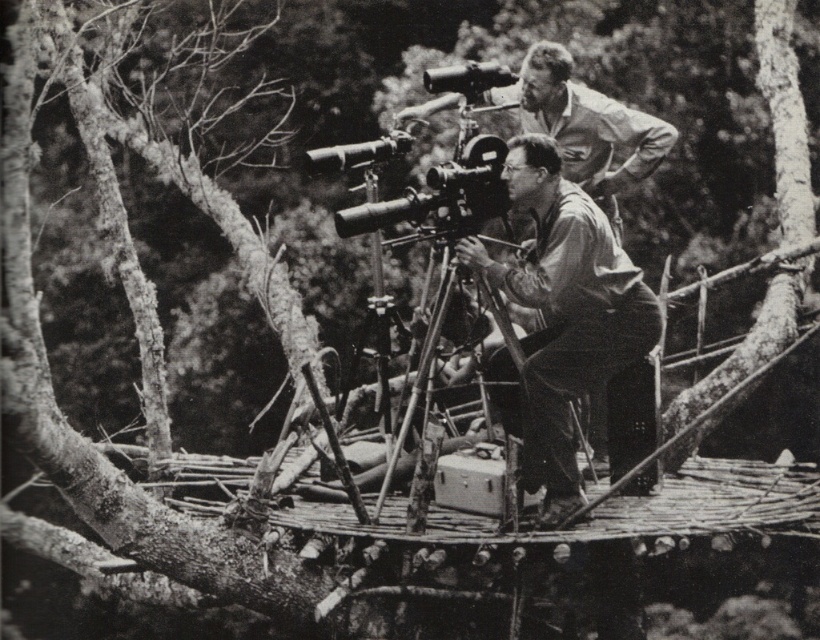
Is matte black camera at center positioned at the back of metallic tripod at center?

No, matte black camera at center is closer to the viewer.

Between point (558, 374) and point (508, 348), which one is positioned in front?

Point (558, 374)

The image size is (820, 640). I want to click on matte black camera at center, so click(x=566, y=310).